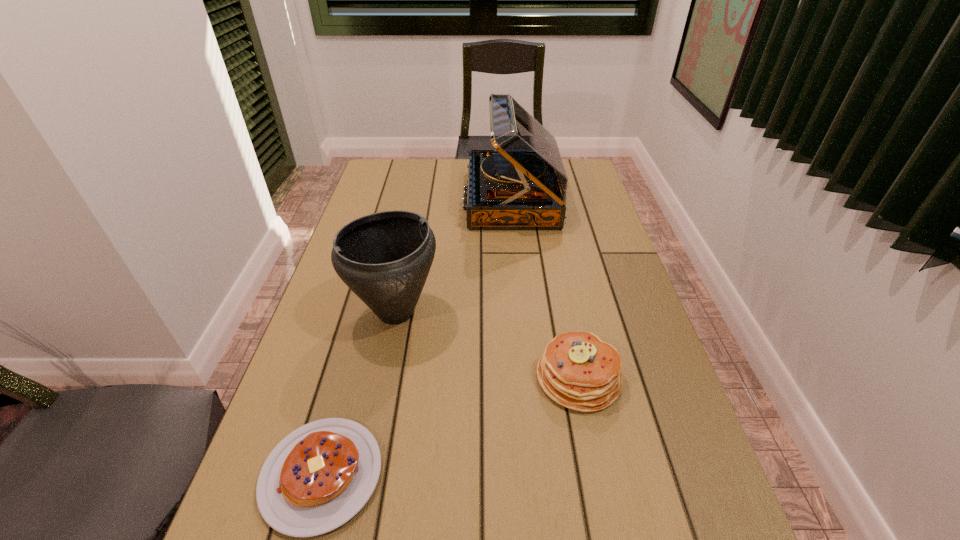
Where is `object that is positioned at the far edge`? The image size is (960, 540). object that is positioned at the far edge is located at coordinates (522, 184).

At what (x,y) coordinates should I click in order to perform the action: click on object that is at the left edge. Please return your answer as a coordinate pair (x, y). The width and height of the screenshot is (960, 540). Looking at the image, I should click on (384, 258).

At what (x,y) coordinates should I click in order to perform the action: click on record player present at the right edge. Please return your answer as a coordinate pair (x, y). The width and height of the screenshot is (960, 540). Looking at the image, I should click on [x=522, y=184].

At what (x,y) coordinates should I click in order to perform the action: click on pancake that is at the right edge. Please return your answer as a coordinate pair (x, y). The width and height of the screenshot is (960, 540). Looking at the image, I should click on (579, 371).

I want to click on object at the far right corner, so click(522, 184).

Locate an element on the screen. The width and height of the screenshot is (960, 540). free space at the far edge is located at coordinates (431, 179).

At what (x,y) coordinates should I click in order to perform the action: click on vacant point at the left edge. Please return your answer as a coordinate pair (x, y). The height and width of the screenshot is (540, 960). Looking at the image, I should click on (285, 404).

Locate an element on the screen. This screenshot has height=540, width=960. vacant space at the right edge of the desktop is located at coordinates (643, 428).

Find the location of `free space between the urn and the taller pancake`. free space between the urn and the taller pancake is located at coordinates (487, 345).

Identify the location of free spot between the record player and the urn. (454, 255).